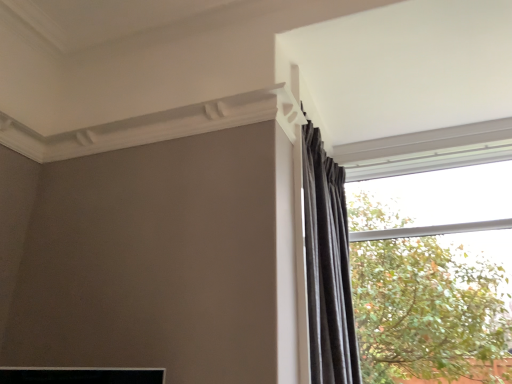
Question: Does black velvet curtain at upper right contain transparent glass window at upper right?

Choices:
 (A) yes
 (B) no

Answer: (B)

Question: Considering the relative positions of black velvet curtain at upper right and transparent glass window at upper right in the image provided, is black velvet curtain at upper right to the right of transparent glass window at upper right from the viewer's perspective?

Choices:
 (A) no
 (B) yes

Answer: (A)

Question: Is black velvet curtain at upper right completely or partially outside of transparent glass window at upper right?

Choices:
 (A) yes
 (B) no

Answer: (A)

Question: Could you tell me if black velvet curtain at upper right is facing transparent glass window at upper right?

Choices:
 (A) yes
 (B) no

Answer: (B)

Question: Is black velvet curtain at upper right beside transparent glass window at upper right?

Choices:
 (A) yes
 (B) no

Answer: (B)

Question: Is black velvet curtain at upper right facing away from transparent glass window at upper right?

Choices:
 (A) no
 (B) yes

Answer: (A)

Question: From a real-world perspective, is transparent glass window at upper right positioned under black velvet curtain at upper right based on gravity?

Choices:
 (A) no
 (B) yes

Answer: (B)

Question: Is transparent glass window at upper right at the left side of black velvet curtain at upper right?

Choices:
 (A) yes
 (B) no

Answer: (B)

Question: Does transparent glass window at upper right have a smaller size compared to black velvet curtain at upper right?

Choices:
 (A) no
 (B) yes

Answer: (B)

Question: Is the position of transparent glass window at upper right less distant than that of black velvet curtain at upper right?

Choices:
 (A) yes
 (B) no

Answer: (B)

Question: From a real-world perspective, is transparent glass window at upper right on top of black velvet curtain at upper right?

Choices:
 (A) no
 (B) yes

Answer: (A)

Question: Is transparent glass window at upper right bigger than black velvet curtain at upper right?

Choices:
 (A) no
 (B) yes

Answer: (A)

Question: From a real-world perspective, is black velvet curtain at upper right physically located above or below transparent glass window at upper right?

Choices:
 (A) below
 (B) above

Answer: (B)